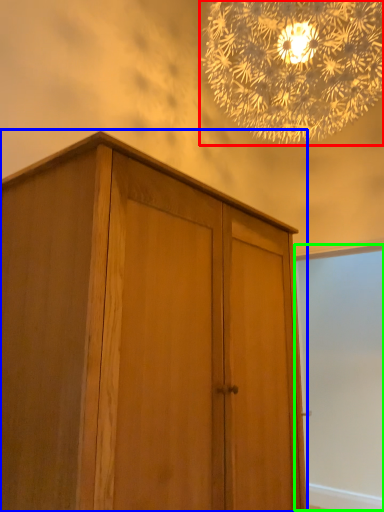
Question: Considering the real-world distances, which object is closest to lamp (highlighted by a red box)? cupboard (highlighted by a blue box) or screen door (highlighted by a green box).

Choices:
 (A) cupboard
 (B) screen door

Answer: (A)